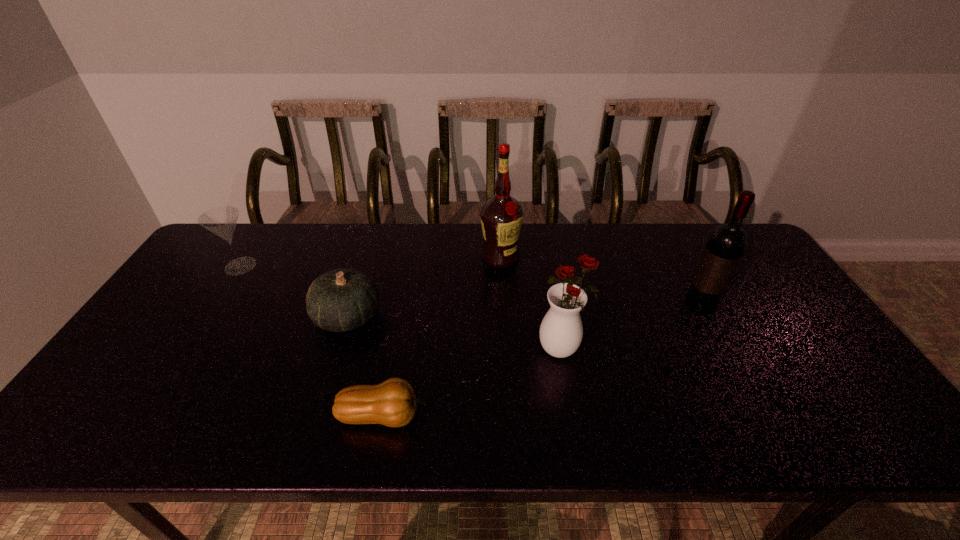
Identify the location of object present at the far left corner. (221, 221).

The height and width of the screenshot is (540, 960). I want to click on blank area at the far edge, so click(368, 259).

This screenshot has width=960, height=540. In the image, there is a desktop. In order to click on vacant space at the near edge in this screenshot , I will do `click(143, 438)`.

Find the location of a particular element. free space at the left edge of the desktop is located at coordinates (166, 386).

You are a GUI agent. You are given a task and a screenshot of the screen. Output one action in this format:
    pyautogui.click(x=<x>, y=<y>)
    Task: Click on the vacant area that lies between the second shortest object and the fourth object from left to right
    Image resolution: width=960 pixels, height=540 pixels.
    Given the screenshot: What is the action you would take?
    pyautogui.click(x=423, y=287)

You are a GUI agent. You are given a task and a screenshot of the screen. Output one action in this format:
    pyautogui.click(x=<x>, y=<y>)
    Task: Click on the vacant area that lies between the shorter gourd and the third tallest object
    This screenshot has width=960, height=540.
    Given the screenshot: What is the action you would take?
    (x=473, y=382)

In order to click on vacant point located between the fifth object from left to right and the alcohol in this screenshot , I will do `click(532, 303)`.

At what (x,y) coordinates should I click in order to perform the action: click on free point between the fourth shortest object and the wine bottle. Please return your answer as a coordinate pair (x, y). The image size is (960, 540). Looking at the image, I should click on (631, 328).

Image resolution: width=960 pixels, height=540 pixels. What are the coordinates of `free point between the vase and the fourth object from left to right` in the screenshot? It's located at (532, 303).

What are the coordinates of `vacant space that is in between the rightmost object and the alcohol` in the screenshot? It's located at (600, 281).